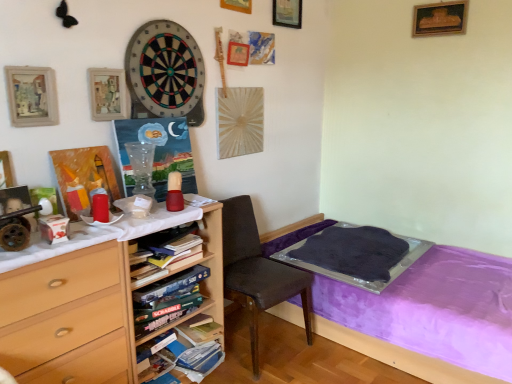
Question: Can you confirm if matte white box at left is shorter than purple fabric bed at lower right?

Choices:
 (A) yes
 (B) no

Answer: (A)

Question: From the image's perspective, would you say matte white box at left is positioned over purple fabric bed at lower right?

Choices:
 (A) yes
 (B) no

Answer: (A)

Question: From a real-world perspective, is matte white box at left located beneath purple fabric bed at lower right?

Choices:
 (A) no
 (B) yes

Answer: (A)

Question: Does matte white box at left have a smaller size compared to purple fabric bed at lower right?

Choices:
 (A) yes
 (B) no

Answer: (A)

Question: Is matte white box at left oriented towards purple fabric bed at lower right?

Choices:
 (A) yes
 (B) no

Answer: (B)

Question: Visually, is matte white box at left positioned to the left or to the right of wooden picture frame at upper right, which is counted as the 5th picture frame, starting from the left?

Choices:
 (A) right
 (B) left

Answer: (B)

Question: Is point coord(50,230) closer or farther from the camera than point coord(449,26)?

Choices:
 (A) closer
 (B) farther

Answer: (A)

Question: From a real-world perspective, is matte white box at left positioned above or below wooden picture frame at upper right, the third picture frame from the top?

Choices:
 (A) below
 (B) above

Answer: (A)

Question: In terms of size, does matte white box at left appear bigger or smaller than wooden picture frame at upper right, the second picture frame positioned from the back?

Choices:
 (A) big
 (B) small

Answer: (B)

Question: Would you say brown fabric chair at center is to the left or to the right of soft felt dartboard at upper center in the picture?

Choices:
 (A) left
 (B) right

Answer: (B)

Question: Considering the positions of point (287, 292) and point (152, 23), is point (287, 292) closer or farther from the camera than point (152, 23)?

Choices:
 (A) closer
 (B) farther

Answer: (B)

Question: In terms of size, does brown fabric chair at center appear bigger or smaller than soft felt dartboard at upper center?

Choices:
 (A) big
 (B) small

Answer: (A)

Question: Considering their positions, is brown fabric chair at center located in front of or behind soft felt dartboard at upper center?

Choices:
 (A) behind
 (B) front

Answer: (A)

Question: In terms of width, does matte wooden picture frame at upper left, the 2th picture frame viewed from the front, look wider or thinner when compared to matte white box at left?

Choices:
 (A) thin
 (B) wide

Answer: (A)

Question: Looking at the image, does matte wooden picture frame at upper left, which ranks as the 4th picture frame in top-to-bottom order, seem bigger or smaller compared to matte white box at left?

Choices:
 (A) small
 (B) big

Answer: (B)